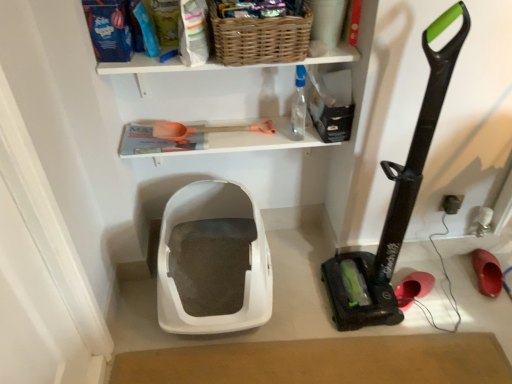
At what (x,y) coordinates should I click in order to perform the action: click on vacant space underneath white plastic litter box at center (from a real-world perspective). Please return your answer as a coordinate pair (x, y). Looking at the image, I should click on (218, 274).